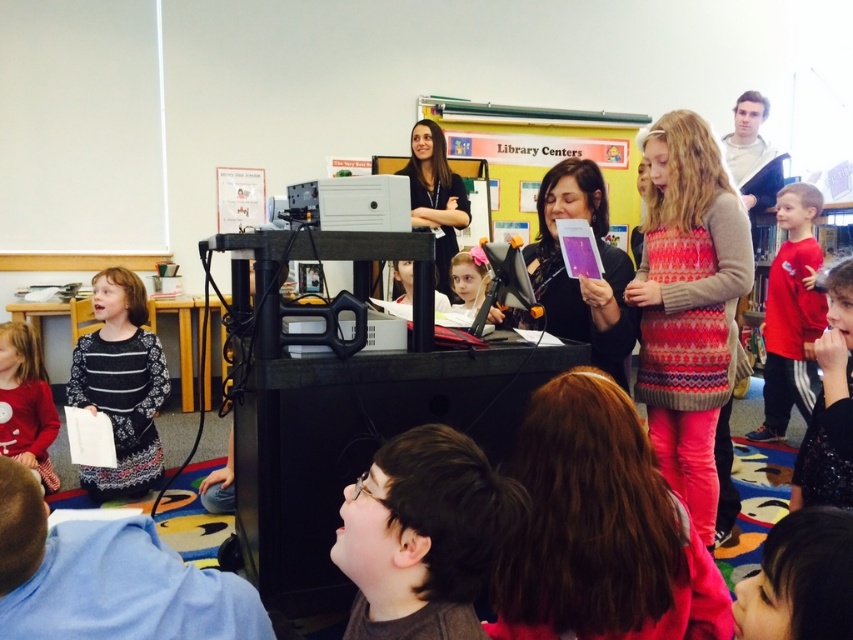
Question: Among these points, which one is nearest to the camera?

Choices:
 (A) (495, 534)
 (B) (444, 180)

Answer: (A)

Question: Which object is positioned closest to the red cotton shirt at right?

Choices:
 (A) sparkly black shirt at lower right
 (B) dark brown hair at lower center
 (C) shiny pink sweater at center
 (D) striped fabric dress at lower left

Answer: (A)

Question: Can you confirm if shiny pink sweater at center is positioned to the right of dark brown hair at lower center?

Choices:
 (A) no
 (B) yes

Answer: (B)

Question: Is striped fabric dress at lower left bigger than pink fabric dress at center?

Choices:
 (A) yes
 (B) no

Answer: (A)

Question: Is shiny pink sweater at center positioned behind dark brown hair at center?

Choices:
 (A) no
 (B) yes

Answer: (A)

Question: Which point is farther to the camera?

Choices:
 (A) red cotton dress at lower left
 (B) sparkly black shirt at lower right
 (C) striped fabric dress at lower left
 (D) pink fabric dress at center

Answer: (C)